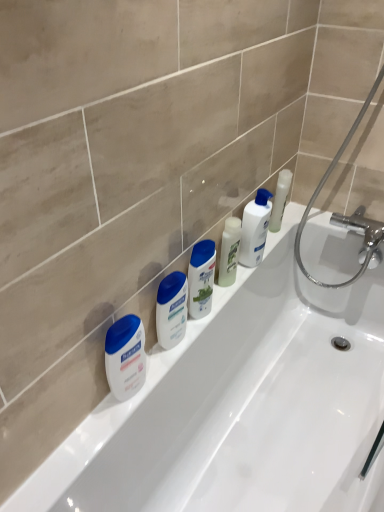
The image size is (384, 512). I want to click on free space in front of white matte lotion at left, so 84,444.